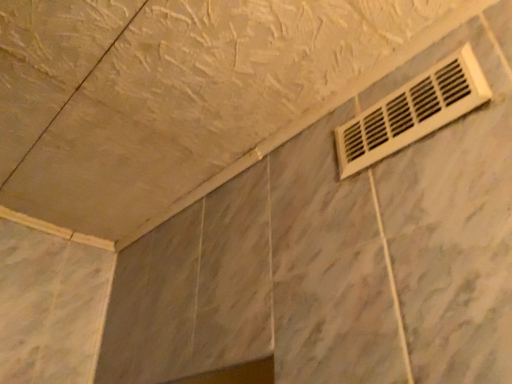
The image size is (512, 384). In order to click on white plastic vent at upper right in this screenshot , I will do `click(412, 111)`.

Measure the distance between white plastic vent at upper right and camera.

They are 63.65 centimeters apart.

This screenshot has height=384, width=512. What do you see at coordinates (412, 111) in the screenshot? I see `white plastic vent at upper right` at bounding box center [412, 111].

In order to click on white plastic vent at upper right in this screenshot , I will do `click(412, 111)`.